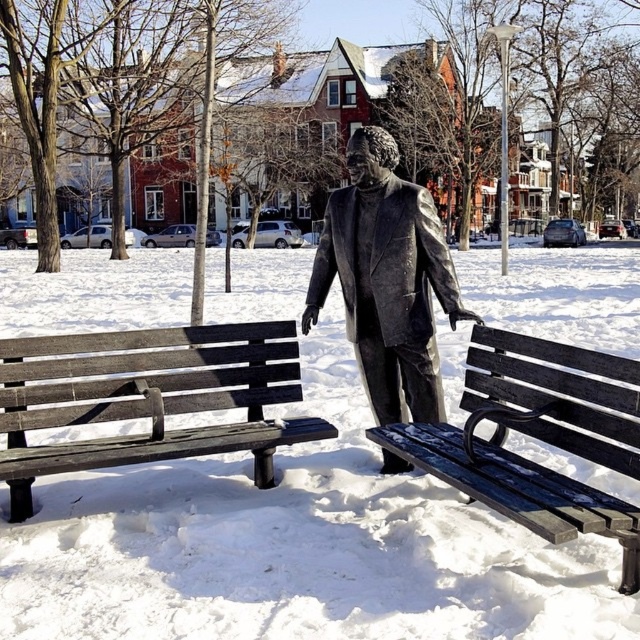
Question: Does white matte snow at center have a larger size compared to wooden bench at left?

Choices:
 (A) yes
 (B) no

Answer: (A)

Question: Which object is farther from the camera taking this photo?

Choices:
 (A) dark wood bench at center
 (B) white matte snow at center

Answer: (B)

Question: Which object is farther from the camera taking this photo?

Choices:
 (A) dark wood bench at center
 (B) wooden bench at left

Answer: (B)

Question: Which object is the closest to the white matte snow at center?

Choices:
 (A) dark wood bench at center
 (B) bronze statue at center

Answer: (A)

Question: Is dark wood bench at center thinner than bronze statue at center?

Choices:
 (A) yes
 (B) no

Answer: (B)

Question: Is white matte snow at center to the left of dark wood bench at center from the viewer's perspective?

Choices:
 (A) no
 (B) yes

Answer: (A)